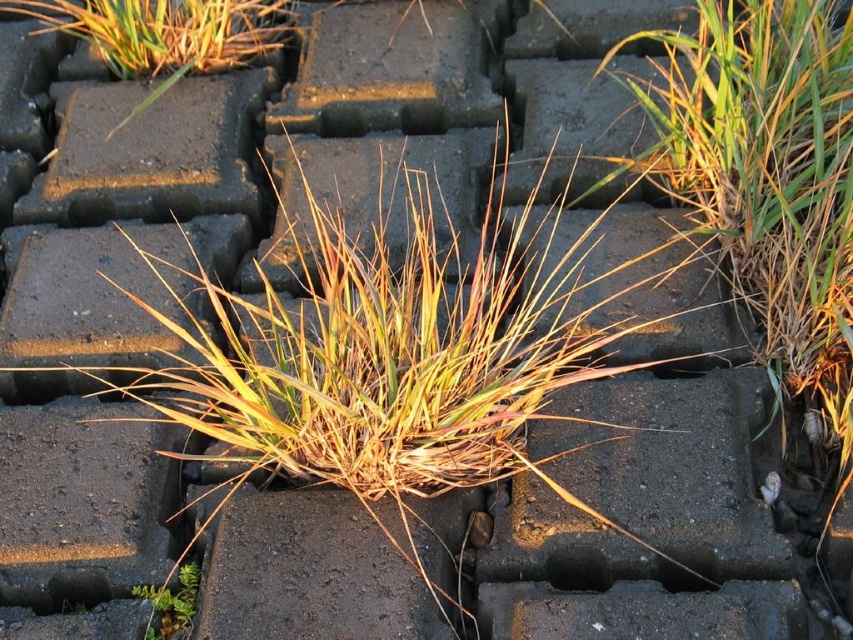
Question: Where is yellow-green grass at upper left located in relation to green matte plant at lower left in the image?

Choices:
 (A) left
 (B) right

Answer: (A)

Question: Which point is closer to the camera taking this photo?

Choices:
 (A) (184, 588)
 (B) (195, 278)
 (C) (122, 22)

Answer: (A)

Question: Which point is farther to the camera?

Choices:
 (A) (241, 438)
 (B) (148, 628)

Answer: (A)

Question: Which of the following is the farthest from the observer?

Choices:
 (A) green matte plant at lower left
 (B) yellow-green grass at center

Answer: (A)

Question: Does yellow-green grass at upper left have a lesser width compared to green matte plant at lower left?

Choices:
 (A) yes
 (B) no

Answer: (B)

Question: Is yellow-green grass at upper left bigger than green matte plant at lower left?

Choices:
 (A) yes
 (B) no

Answer: (A)